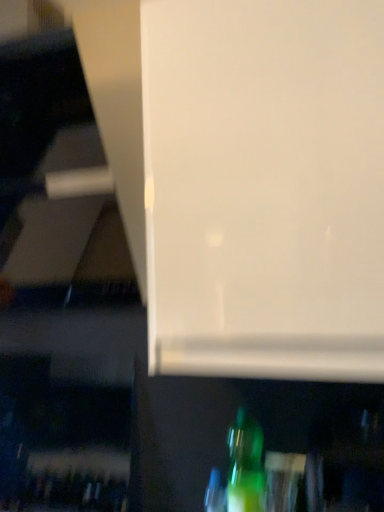
Question: Can you confirm if green glass bottle at lower center, which is counted as the second bottle, starting from the left, is bigger than translucent green bottle at lower center, the 2th bottle when ordered from right to left?

Choices:
 (A) yes
 (B) no

Answer: (A)

Question: From the image's perspective, is green glass bottle at lower center, the 1th bottle positioned from the right, located beneath translucent green bottle at lower center, which ranks as the 1th bottle in left-to-right order?

Choices:
 (A) yes
 (B) no

Answer: (B)

Question: Is green glass bottle at lower center, the 1th bottle positioned from the right, in contact with translucent green bottle at lower center, the 2th bottle when ordered from right to left?

Choices:
 (A) yes
 (B) no

Answer: (A)

Question: Is green glass bottle at lower center, which is counted as the second bottle, starting from the left, at the right side of translucent green bottle at lower center, which ranks as the 1th bottle in left-to-right order?

Choices:
 (A) no
 (B) yes

Answer: (B)

Question: Is green glass bottle at lower center, the 1th bottle positioned from the right, oriented towards translucent green bottle at lower center, the 2th bottle when ordered from right to left?

Choices:
 (A) no
 (B) yes

Answer: (A)

Question: Does green glass bottle at lower center, which is counted as the second bottle, starting from the left, appear on the left side of translucent green bottle at lower center, which ranks as the 1th bottle in left-to-right order?

Choices:
 (A) yes
 (B) no

Answer: (B)

Question: Does translucent green bottle at lower center, which ranks as the 1th bottle in left-to-right order, have a lesser width compared to green glass bottle at lower center, which is counted as the second bottle, starting from the left?

Choices:
 (A) yes
 (B) no

Answer: (A)

Question: Does translucent green bottle at lower center, the 2th bottle when ordered from right to left, have a smaller size compared to green glass bottle at lower center, the 1th bottle positioned from the right?

Choices:
 (A) no
 (B) yes

Answer: (B)

Question: Is translucent green bottle at lower center, which ranks as the 1th bottle in left-to-right order, to the right of green glass bottle at lower center, the 1th bottle positioned from the right, from the viewer's perspective?

Choices:
 (A) no
 (B) yes

Answer: (A)

Question: Does translucent green bottle at lower center, the 2th bottle when ordered from right to left, have a lesser height compared to green glass bottle at lower center, which is counted as the second bottle, starting from the left?

Choices:
 (A) yes
 (B) no

Answer: (A)

Question: Would you say green glass bottle at lower center, which is counted as the second bottle, starting from the left, is part of translucent green bottle at lower center, the 2th bottle when ordered from right to left,'s contents?

Choices:
 (A) yes
 (B) no

Answer: (B)

Question: From the image's perspective, is translucent green bottle at lower center, which ranks as the 1th bottle in left-to-right order, under green glass bottle at lower center, the 1th bottle positioned from the right?

Choices:
 (A) no
 (B) yes

Answer: (B)

Question: In the image, is translucent green bottle at lower center, which ranks as the 1th bottle in left-to-right order, positioned in front of or behind green glass bottle at lower center, which is counted as the second bottle, starting from the left?

Choices:
 (A) front
 (B) behind

Answer: (B)